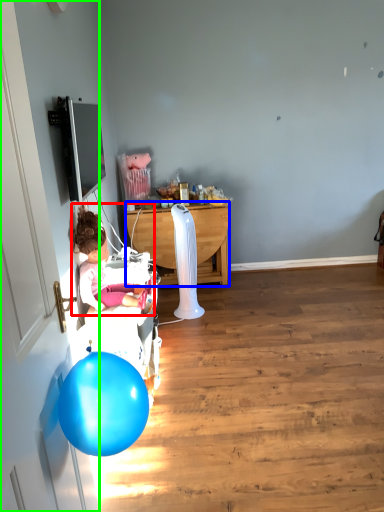
Question: Estimate the real-world distances between objects in this image. Which object is farther from person (highlighted by a red box), desk (highlighted by a blue box) or door (highlighted by a green box)?

Choices:
 (A) desk
 (B) door

Answer: (A)